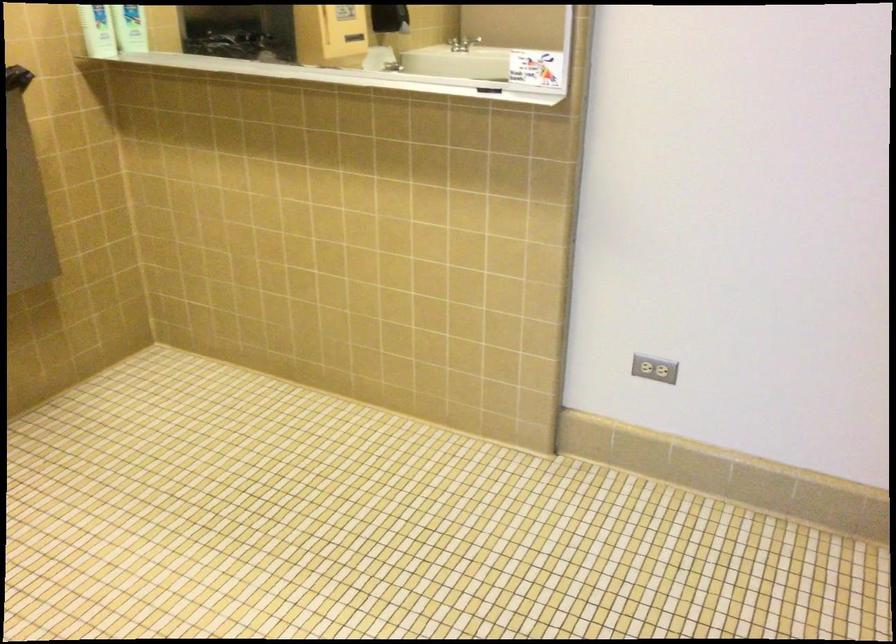
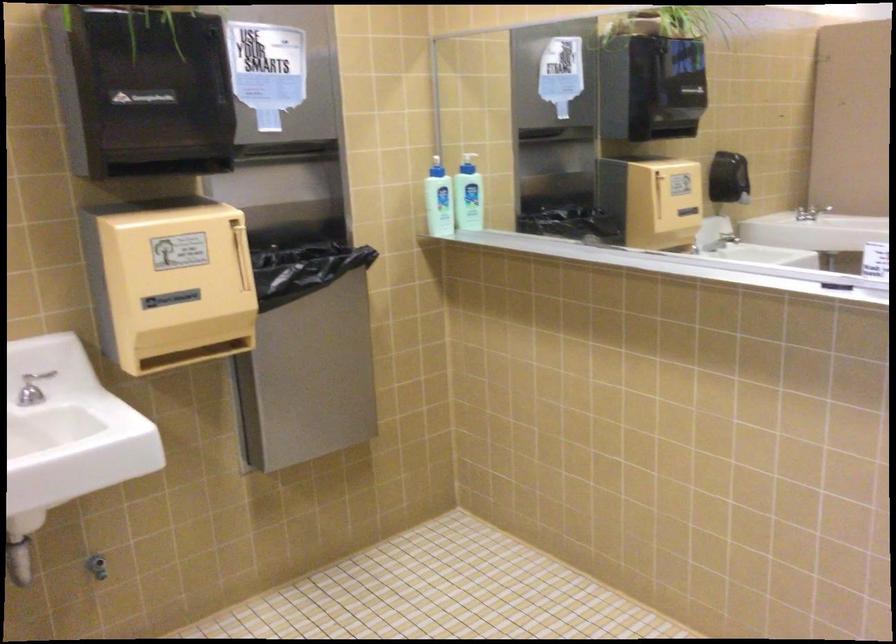
Question: Which direction would the cameraman need to move to produce the second image? Reply with the corresponding letter.

Choices:
 (A) Left
 (B) Right
 (C) Forward
 (D) Backward

Answer: (C)